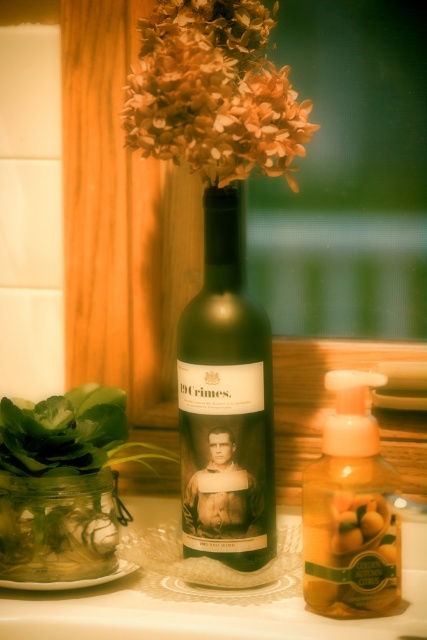
Question: Is matte black bottle at center behind orange matte flowers at upper center?

Choices:
 (A) yes
 (B) no

Answer: (A)

Question: Which point is farther from the camera taking this photo?

Choices:
 (A) (195, 324)
 (B) (335, 504)

Answer: (A)

Question: Which point is closer to the camera?

Choices:
 (A) yellow translucent soap dispenser at center
 (B) matte black bottle at center
 (C) clear glass jar at lower left
 (D) orange matte flowers at upper center

Answer: (D)

Question: Observing the image, what is the correct spatial positioning of yellow translucent soap dispenser at center in reference to clear glass jar at lower left?

Choices:
 (A) above
 (B) below

Answer: (A)

Question: Observing the image, what is the correct spatial positioning of matte black bottle at center in reference to yellow translucent soap dispenser at center?

Choices:
 (A) below
 (B) above

Answer: (B)

Question: Considering the real-world distances, which object is closest to the orange matte flowers at upper center?

Choices:
 (A) yellow translucent soap dispenser at center
 (B) clear glass jar at lower left

Answer: (A)